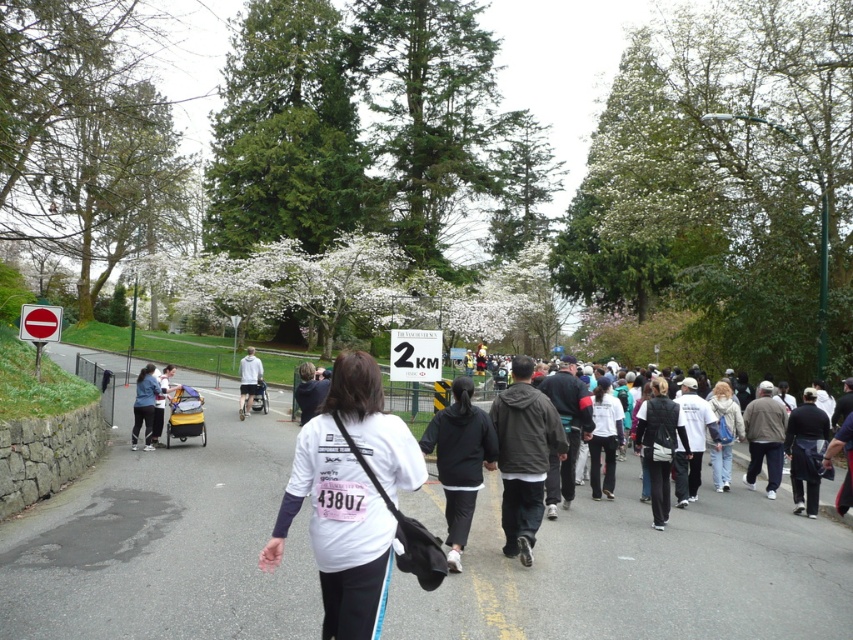
You are a photographer at the event and want to capture both the white matte shirt at center and the white fuzzy jacket at right in the same frame. Based on their positions, which one should you focus on first to ensure both are in the shot?

You should focus on the white matte shirt at center first since it is to the left of the white fuzzy jacket at right, allowing the photographer to frame both subjects appropriately.

From the picture: You are a photographer at the event and want to capture a photo of both the white fabric shirt at center and the white matte shirt at center. Which shirt should you focus on to ensure it appears wider in the photo?

The white fabric shirt at center is wider than the white matte shirt at center, so focusing on the white fabric shirt at center will ensure it appears wider in the photo.

You are a photographer at the event and want to capture both the white matte shirt at center and the white fuzzy jacket at right in a single shot. Since the lighting is diffused, you need to ensure both subjects are visible. Based on their positions, which subject should you focus on first to ensure proper exposure?

The white matte shirt at center is located above the white fuzzy jacket at right. To ensure proper exposure for both subjects, focus on the white fuzzy jacket at right first since it is lower in the frame and may be in shadow from the overcast sky.